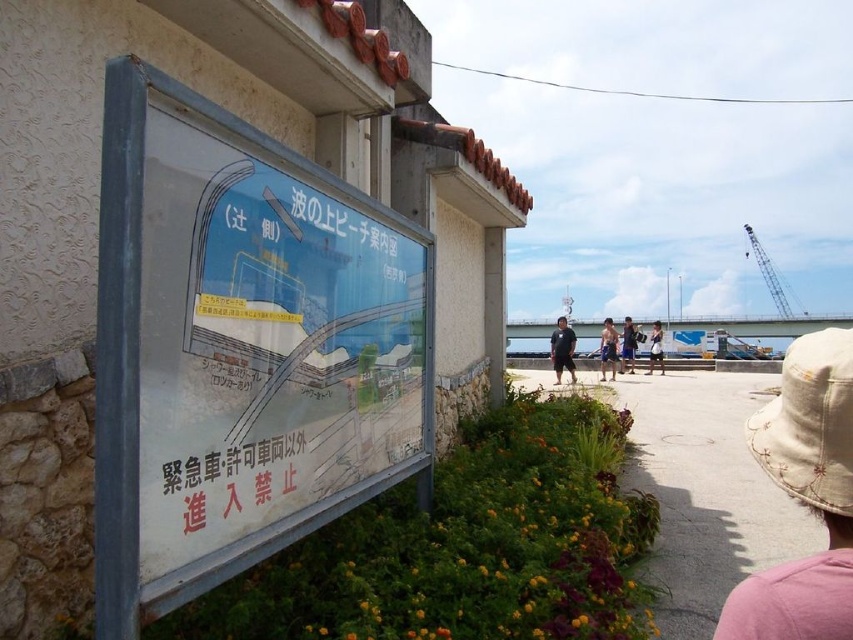
Question: Which is farther from the blue fabric shorts at center?

Choices:
 (A) tan fabric shorts at center
 (B) blue denim shorts at center
 (C) beige fabric hat at lower right
 (D) matte black shirt at center

Answer: (C)

Question: Which object is positioned closest to the blue fabric shorts at center?

Choices:
 (A) beige fabric hat at lower right
 (B) white plastic sign at center
 (C) matte black shirt at center
 (D) tan fabric shorts at center

Answer: (D)

Question: Can you confirm if matte black shirt at center is smaller than tan fabric shorts at center?

Choices:
 (A) yes
 (B) no

Answer: (B)

Question: Which point is farther to the camera?

Choices:
 (A) (653, 371)
 (B) (428, 252)

Answer: (A)

Question: Is beige fabric hat at lower right behind blue fabric shorts at center?

Choices:
 (A) yes
 (B) no

Answer: (B)

Question: Does blue denim shorts at center appear on the right side of tan fabric shorts at center?

Choices:
 (A) no
 (B) yes

Answer: (A)